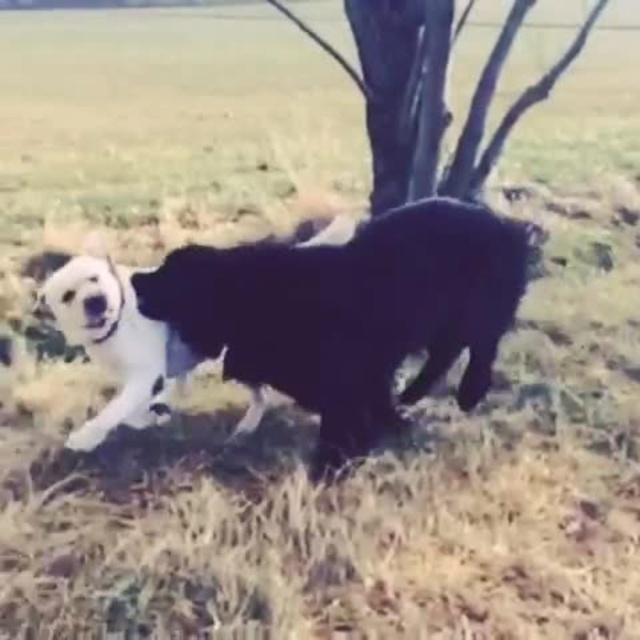
Can you confirm if black fluffy dog at center is positioned to the right of black matte tree at upper center?

No, black fluffy dog at center is not to the right of black matte tree at upper center.

Which is more to the left, black fluffy dog at center or black matte tree at upper center?

From the viewer's perspective, black fluffy dog at center appears more on the left side.

Image resolution: width=640 pixels, height=640 pixels. Find the location of `black fluffy dog at center`. black fluffy dog at center is located at coordinates (348, 314).